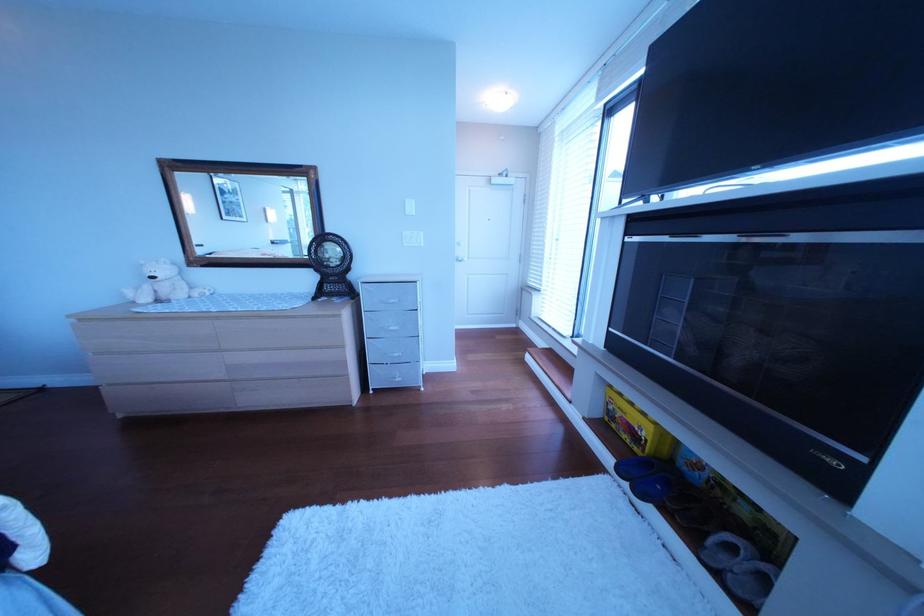
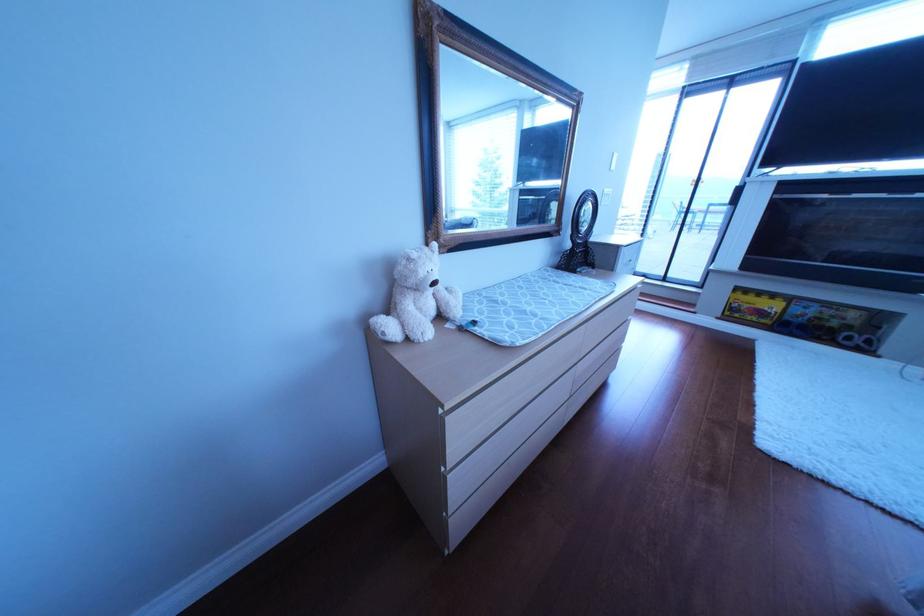
The point at (600, 421) is marked in the first image. Where is the corresponding point in the second image?

(733, 320)